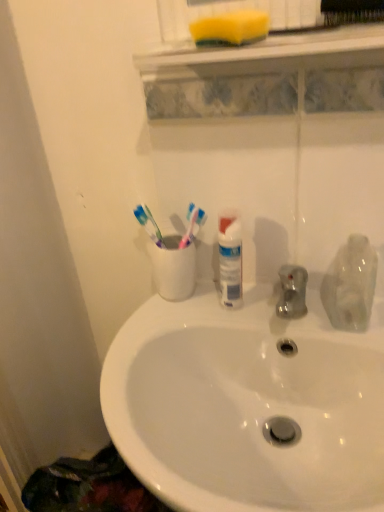
Question: Would you say transparent plastic bottle at right is inside or outside yellow sponge at upper center?

Choices:
 (A) outside
 (B) inside

Answer: (A)

Question: Is point (359, 268) positioned closer to the camera than point (231, 52)?

Choices:
 (A) farther
 (B) closer

Answer: (A)

Question: Which object is positioned closest to the white glossy sink at center?

Choices:
 (A) yellow sponge at upper center
 (B) transparent plastic bottle at right
 (C) yellow sponge at upper center
 (D) black bristle brush at upper center

Answer: (B)

Question: Which of these objects is positioned closest to the black bristle brush at upper center?

Choices:
 (A) transparent plastic bottle at right
 (B) yellow sponge at upper center
 (C) white glossy sink at center
 (D) yellow sponge at upper center

Answer: (D)